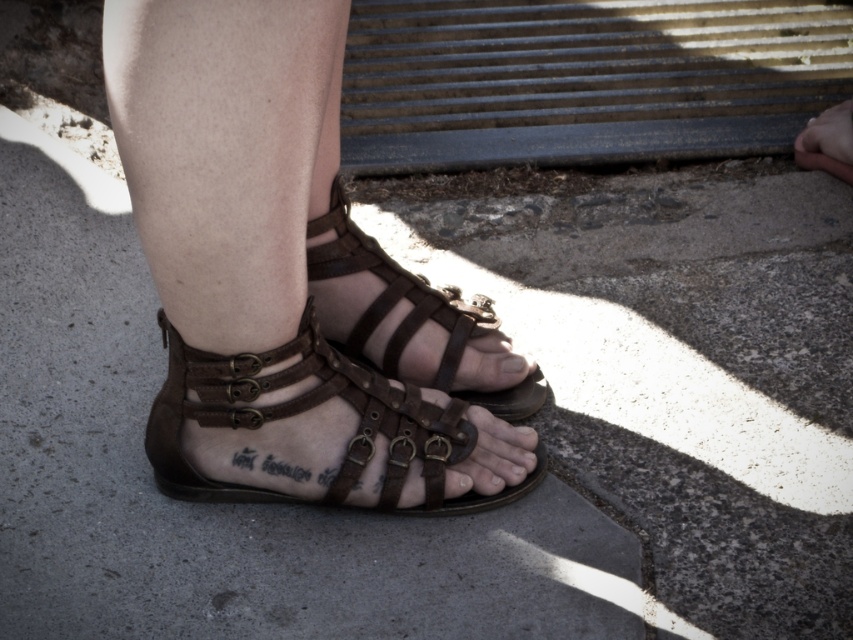
You are a shoemaker examining two pairs of brown leather sandals at center and brown leather sandals at lower center in the image. Which pair is bigger?

The brown leather sandals at center has a larger size compared to the brown leather sandals at lower center.

You are a shoemaker examining the brown leather sandal at center and the brown leather toe at center. Which object is wider?

The brown leather sandal at center is wider than the brown leather toe at center because the sandal has a greater width according to the description.

What are the coordinates of the brown leather sandals at center?

The coordinates of the brown leather sandals at center are at point (x=292, y=280).